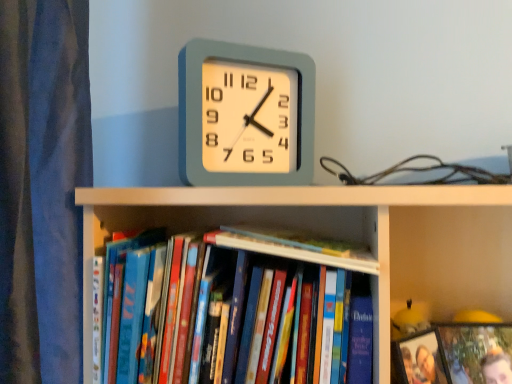
Question: Can we say hardcover book at center, positioned as the 2th book in left-to-right order, lies outside wooden photo frame at lower right?

Choices:
 (A) no
 (B) yes

Answer: (B)

Question: Is hardcover book at center, positioned as the 2th book in left-to-right order, to the right of wooden photo frame at lower right from the viewer's perspective?

Choices:
 (A) yes
 (B) no

Answer: (B)

Question: From the image's perspective, does hardcover book at center, which is the second book in right-to-left order, appear lower than wooden photo frame at lower right?

Choices:
 (A) no
 (B) yes

Answer: (A)

Question: Can you confirm if hardcover book at center, positioned as the 2th book in left-to-right order, is shorter than wooden photo frame at lower right?

Choices:
 (A) yes
 (B) no

Answer: (A)

Question: Considering the relative sizes of hardcover book at center, which is the second book in right-to-left order, and wooden photo frame at lower right in the image provided, is hardcover book at center, which is the second book in right-to-left order, taller than wooden photo frame at lower right?

Choices:
 (A) no
 (B) yes

Answer: (A)

Question: Is matte plastic clock at center in front of or behind hardcover books at center, marked as the 1th book in a left-to-right arrangement, in the image?

Choices:
 (A) front
 (B) behind

Answer: (B)

Question: Choose the correct answer: Is matte plastic clock at center inside hardcover books at center, marked as the 1th book in a left-to-right arrangement, or outside it?

Choices:
 (A) outside
 (B) inside

Answer: (A)

Question: In terms of size, does matte plastic clock at center appear bigger or smaller than hardcover books at center, which is counted as the third book, starting from the right?

Choices:
 (A) small
 (B) big

Answer: (A)

Question: Visually, is matte plastic clock at center positioned to the left or to the right of hardcover books at center, marked as the 1th book in a left-to-right arrangement?

Choices:
 (A) right
 (B) left

Answer: (A)

Question: From a real-world perspective, relative to matte plastic photo frame at lower right, which ranks as the first book in right-to-left order, is hardcover book at left vertically above or below?

Choices:
 (A) below
 (B) above

Answer: (B)

Question: In the image, is hardcover book at left positioned in front of or behind matte plastic photo frame at lower right, the third book when ordered from left to right?

Choices:
 (A) front
 (B) behind

Answer: (A)

Question: From the image's perspective, is hardcover book at left positioned above or below matte plastic photo frame at lower right, the third book when ordered from left to right?

Choices:
 (A) below
 (B) above

Answer: (B)

Question: Considering the positions of point (120, 324) and point (498, 342), is point (120, 324) closer or farther from the camera than point (498, 342)?

Choices:
 (A) farther
 (B) closer

Answer: (B)

Question: From the image's perspective, is matte plastic photo frame at lower right, the third book when ordered from left to right, above or below wooden photo frame at lower right?

Choices:
 (A) below
 (B) above

Answer: (A)

Question: Considering their positions, is matte plastic photo frame at lower right, the third book when ordered from left to right, located in front of or behind wooden photo frame at lower right?

Choices:
 (A) front
 (B) behind

Answer: (B)